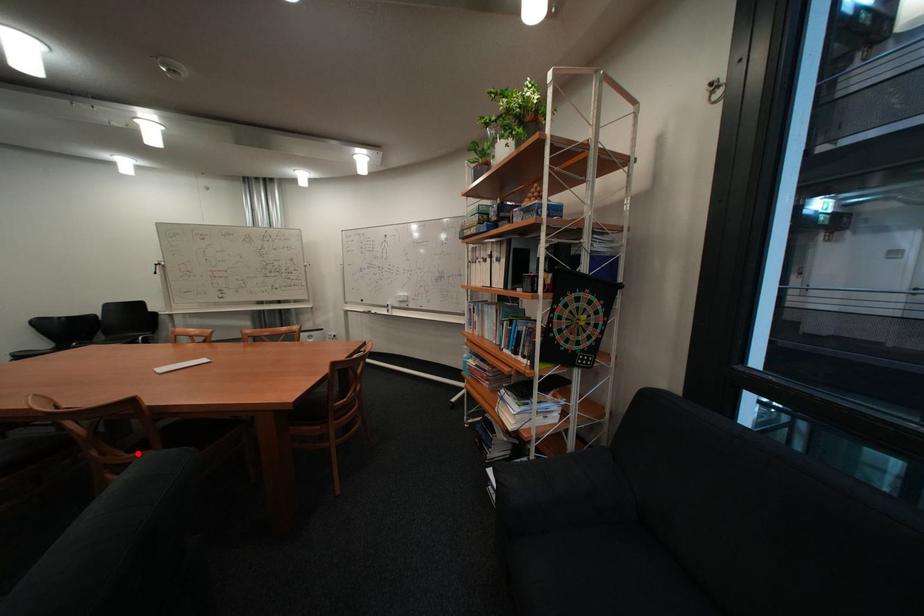
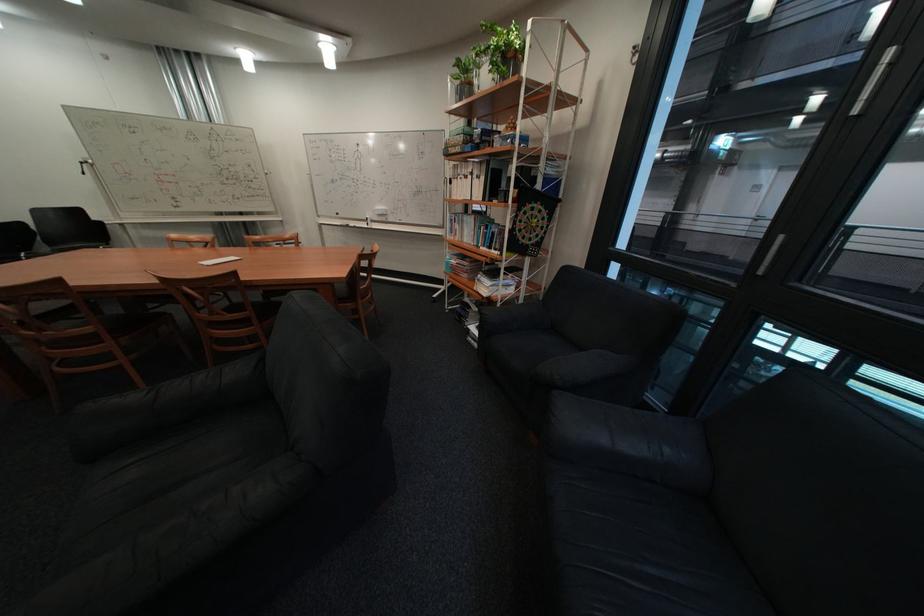
The point at the highlighted location is marked in the first image. Where is the corresponding point in the second image?

(240, 314)